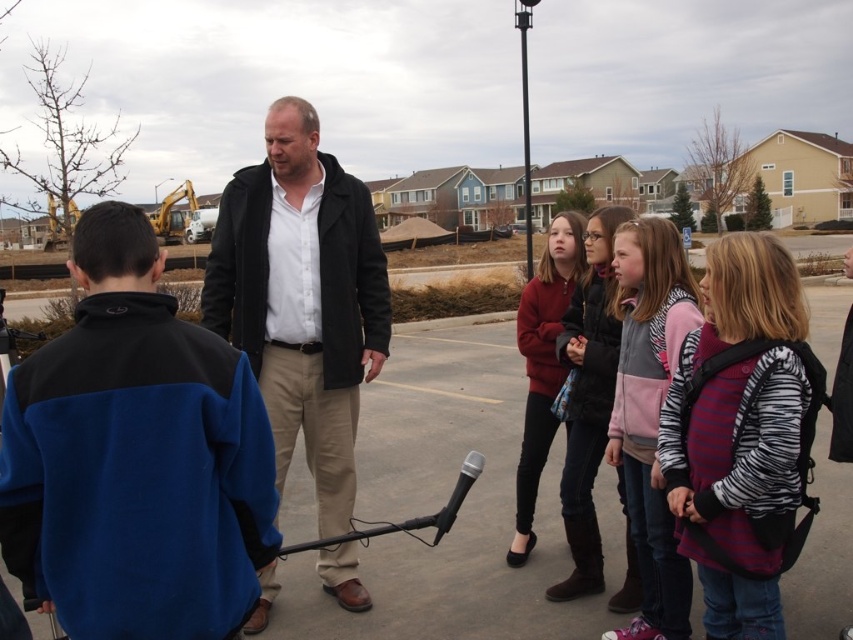
You are a photographer trying to capture a closeup of the matte black jacket at center and zebra print jacket at center. Since you can only focus on one jacket at a time, which jacket should you focus on first if you want to ensure the closest one is in focus?

The matte black jacket at center is to the left of the zebra print jacket at center, so if you are facing the jackets, the matte black jacket at center is closer to you. Therefore, focus on the matte black jacket at center first to ensure it is in focus.